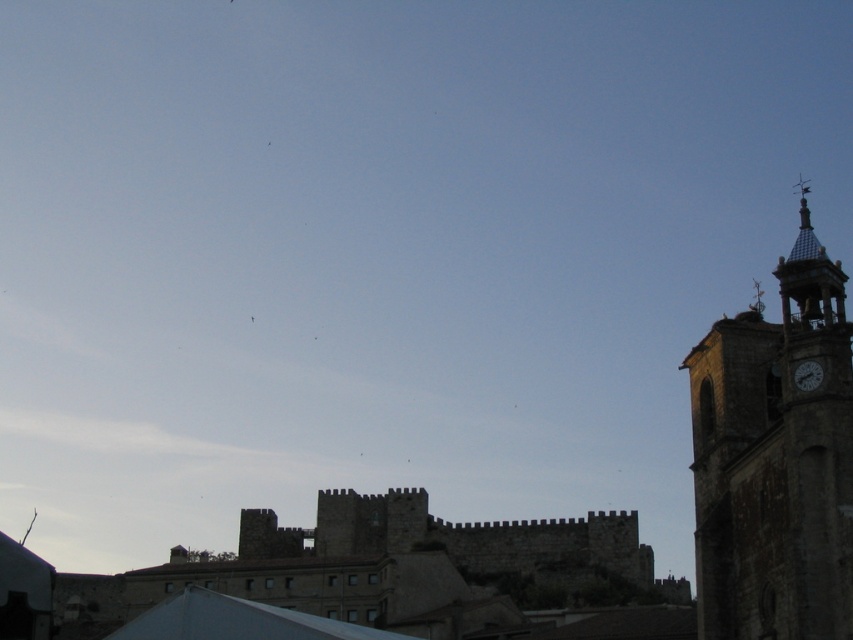
You are a tourist standing in front of the historic stone structure. You notice the dark stone clock tower at right and the white fabric canopy at lower center. Which object is taller?

The dark stone clock tower at right is taller than the white fabric canopy at lower center.

You are standing in front of the historic stone structure and want to determine the relative positions of two points marked in the scene. Which point is closer to you, point (769, 349) or point (811, 369)?

Point (769, 349) is closer to you because it is further to the viewer than point (811, 369).

You are standing at the center of the image. Which direction should you face to look directly at the dark stone clock tower at right?

Since the dark stone clock tower at right is located at point 0.720 on the x axis and 0.910 on the y axis, you should face towards the right side of the image to look directly at it.